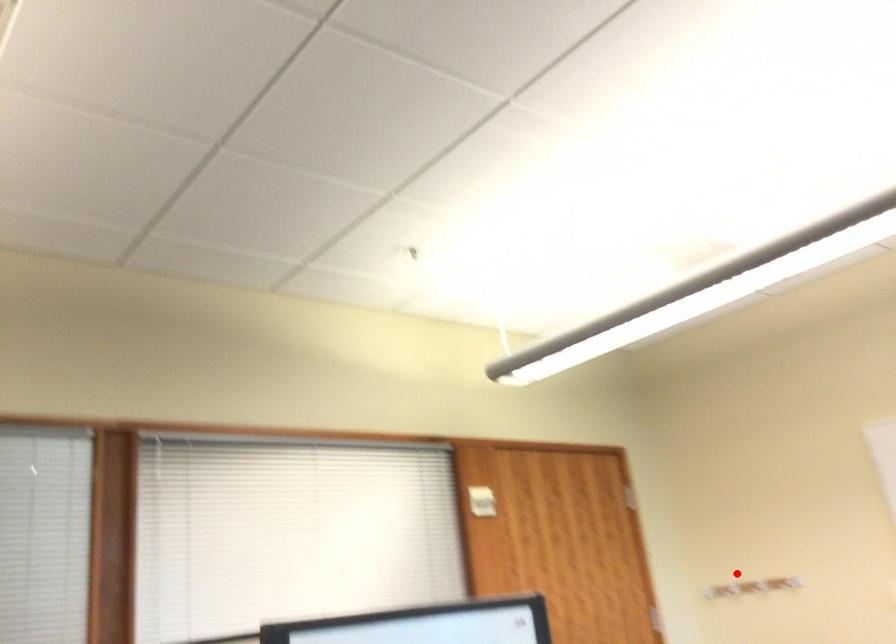
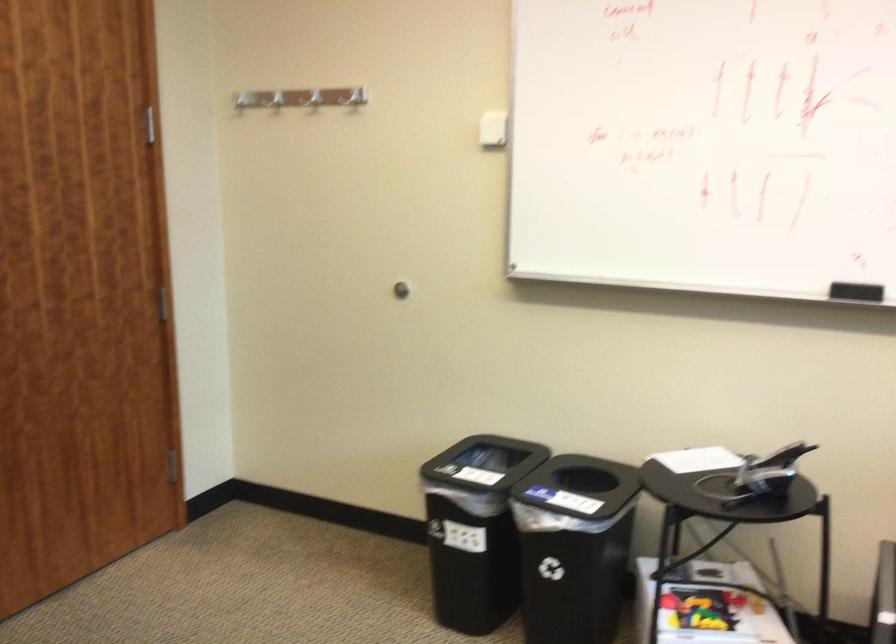
Question: I am providing you with two images of the same scene from different viewpoints. Given a red point in image1, look at the same physical point in image2. Is it:

Choices:
 (A) Closer to the viewpoint
 (B) Farther from the viewpoint

Answer: (A)